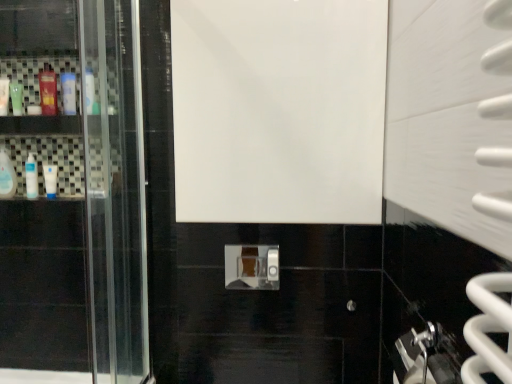
Question: Does white glossy bottle at left, the 1th mouthwash from the right, lie in front of white glossy bottle at left, positioned as the third mouthwash in left-to-right order?

Choices:
 (A) yes
 (B) no

Answer: (A)

Question: Can you confirm if white glossy bottle at left, the 1th mouthwash from the right, is taller than white glossy bottle at left, positioned as the third mouthwash in left-to-right order?

Choices:
 (A) yes
 (B) no

Answer: (B)

Question: Does white glossy bottle at left, the 1th mouthwash from the right, have a greater width compared to white glossy bottle at left, acting as the fourth mouthwash starting from the right?

Choices:
 (A) no
 (B) yes

Answer: (B)

Question: From the image's perspective, does white glossy bottle at left, the 1th mouthwash from the right, appear higher than white glossy bottle at left, acting as the fourth mouthwash starting from the right?

Choices:
 (A) no
 (B) yes

Answer: (B)

Question: Considering the relative sizes of white glossy bottle at left, which is the sixth mouthwash from left to right, and white glossy bottle at left, acting as the fourth mouthwash starting from the right, in the image provided, is white glossy bottle at left, which is the sixth mouthwash from left to right, thinner than white glossy bottle at left, acting as the fourth mouthwash starting from the right,?

Choices:
 (A) no
 (B) yes

Answer: (A)

Question: Is point (17, 100) positioned closer to the camera than point (30, 18)?

Choices:
 (A) farther
 (B) closer

Answer: (A)

Question: Visually, is green matte bottle at left, which is the fifth mouthwash from right to left, positioned to the left or to the right of white glossy door at center?

Choices:
 (A) left
 (B) right

Answer: (A)

Question: Is green matte bottle at left, the second mouthwash when ordered from left to right, inside or outside of white glossy door at center?

Choices:
 (A) outside
 (B) inside

Answer: (A)

Question: From the image's perspective, relative to white glossy door at center, is green matte bottle at left, the second mouthwash when ordered from left to right, above or below?

Choices:
 (A) above
 (B) below

Answer: (A)

Question: Considering their positions, is clear plastic bottle at left, the 6th mouthwash from the right, located in front of or behind green matte bottle at left, which is the fifth mouthwash from right to left?

Choices:
 (A) front
 (B) behind

Answer: (B)

Question: In the image, is clear plastic bottle at left, which is the first mouthwash in left-to-right order, on the left side or the right side of green matte bottle at left, the second mouthwash when ordered from left to right?

Choices:
 (A) right
 (B) left

Answer: (B)

Question: Looking at their shapes, would you say clear plastic bottle at left, the 6th mouthwash from the right, is wider or thinner than green matte bottle at left, which is the fifth mouthwash from right to left?

Choices:
 (A) wide
 (B) thin

Answer: (A)

Question: Is clear plastic bottle at left, which is the first mouthwash in left-to-right order, taller or shorter than green matte bottle at left, the second mouthwash when ordered from left to right?

Choices:
 (A) tall
 (B) short

Answer: (A)

Question: Is white glossy bottle at left, the 1th mouthwash from the right, spatially inside clear plastic bottle at left, which is the first mouthwash in left-to-right order, or outside of it?

Choices:
 (A) outside
 (B) inside

Answer: (A)

Question: From a real-world perspective, is white glossy bottle at left, which is the sixth mouthwash from left to right, physically located above or below clear plastic bottle at left, the 6th mouthwash from the right?

Choices:
 (A) above
 (B) below

Answer: (A)